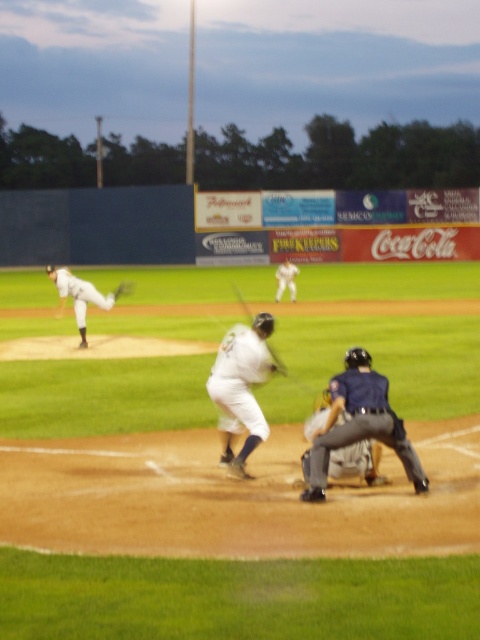
Question: Is white matte baseball pitcher at left thinner than dark brown leather glove at center?

Choices:
 (A) yes
 (B) no

Answer: (B)

Question: Among these objects, which one is nearest to the camera?

Choices:
 (A) wooden baseball bat at center
 (B) gray fabric catcher at center
 (C) white uniform at center

Answer: (B)

Question: Which point is farther to the camera?

Choices:
 (A) (325, 404)
 (B) (113, 292)
 (C) (244, 312)
 (D) (277, 280)

Answer: (D)

Question: Which of the following is the farthest from the observer?

Choices:
 (A) (348, 474)
 (B) (275, 298)
 (C) (231, 353)

Answer: (B)

Question: Is gray fabric catcher at center below dark brown leather glove at center?

Choices:
 (A) no
 (B) yes

Answer: (B)

Question: Is white matte baseball pitcher at left smaller than dark brown leather glove at center?

Choices:
 (A) yes
 (B) no

Answer: (B)